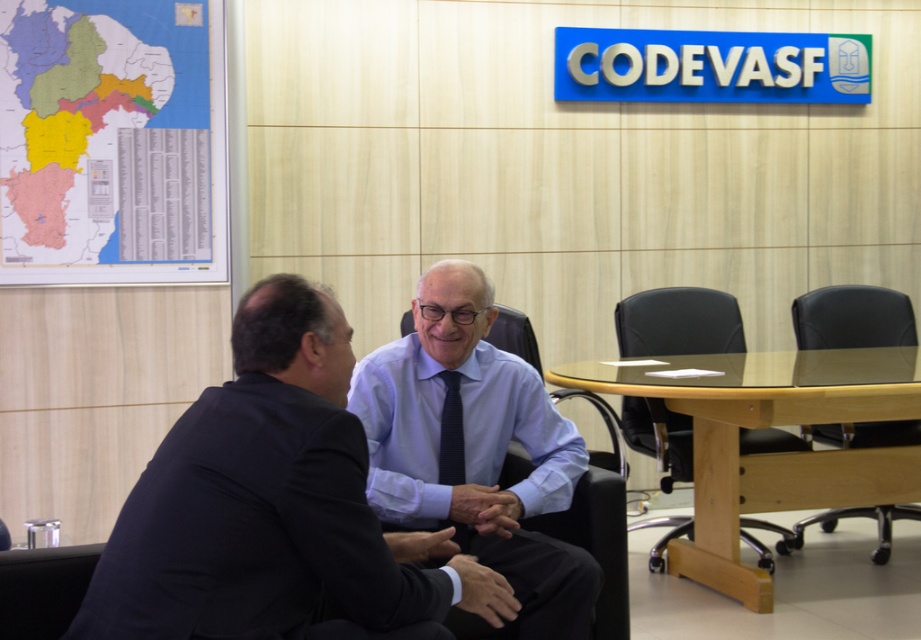
You are a photographer setting up for a professional headshot session in this office. You want to ensure the matte black suit at center and the light brown wooden table at center are both visible in the frame. Based on their positions, which object should you focus on first to capture both effectively?

The matte black suit at center is above the light brown wooden table at center, so focusing on the matte black suit at center first will ensure both objects are in the frame.

You are a visitor entering the office and need to sit down at the light brown wooden table at center. Which direction should you walk to reach the table from the matte black suit at center?

The matte black suit at center is positioned on the left side of the light brown wooden table at center, so you should walk to the right to reach the table from the matte black suit at center.

You are planning to place a new rectangular desk between the matte black suit at center and the black leather chair at center. Considering the space between them, can the desk be placed without overlapping either object?

The matte black suit at center might be wider than black leather chair at center, so placing a desk between them could be challenging due to the potential width of the suit. It is advisable to measure the exact dimensions before deciding.